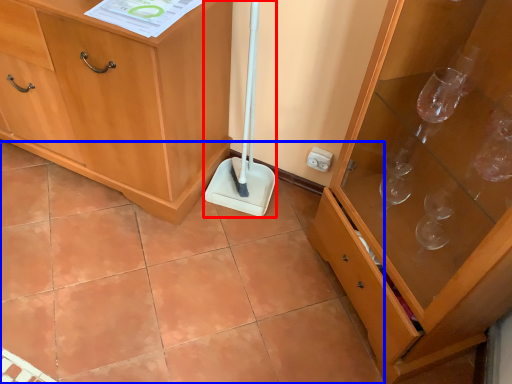
Question: Which point is closer to the camera, shovel (highlighted by a red box) or ceramic tile (highlighted by a blue box)?

Choices:
 (A) shovel
 (B) ceramic tile

Answer: (B)